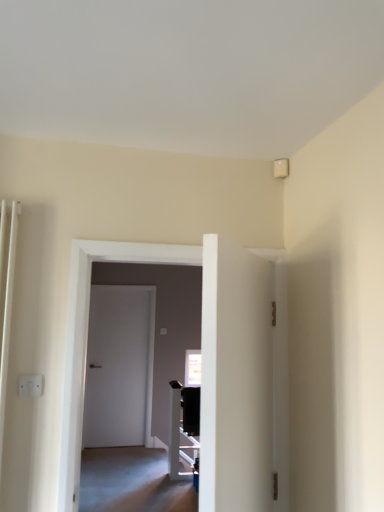
Where is `free location in front of black glossy tv at center`? This screenshot has width=384, height=512. free location in front of black glossy tv at center is located at coordinates (172, 483).